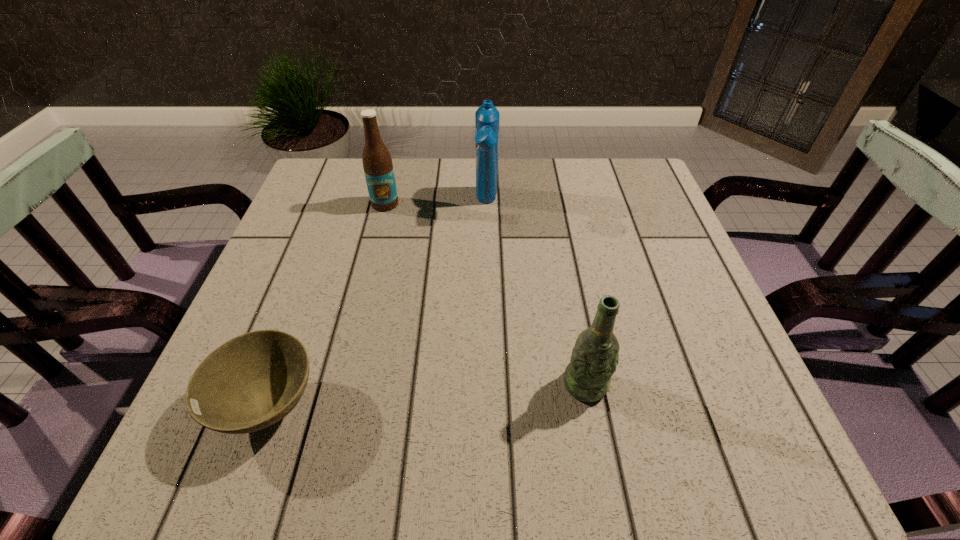
You are a GUI agent. You are given a task and a screenshot of the screen. Output one action in this format:
    pyautogui.click(x=<x>, y=<y>)
    Task: Click on the beer bottle located at the far edge
    
    Given the screenshot: What is the action you would take?
    pyautogui.click(x=378, y=168)

Find the location of `object positioned at the near edge`. object positioned at the near edge is located at coordinates (254, 380).

Identify the location of object present at the left edge. The width and height of the screenshot is (960, 540). (254, 380).

Where is `object positioned at the near left corner`? Image resolution: width=960 pixels, height=540 pixels. object positioned at the near left corner is located at coordinates (254, 380).

Identify the location of free point at the far edge. The image size is (960, 540). (543, 171).

Where is `vacant region at the near edge of the desktop`? Image resolution: width=960 pixels, height=540 pixels. vacant region at the near edge of the desktop is located at coordinates (490, 457).

At what (x,y) coordinates should I click in order to perform the action: click on blank area at the left edge. Please return your answer as a coordinate pair (x, y). This screenshot has height=540, width=960. Looking at the image, I should click on (317, 269).

In the image, there is a desktop. At what (x,y) coordinates should I click in order to perform the action: click on vacant space at the right edge. Please return your answer as a coordinate pair (x, y). Looking at the image, I should click on point(654,249).

The image size is (960, 540). Find the location of `vacant space at the far left corner of the desktop`. vacant space at the far left corner of the desktop is located at coordinates (316, 166).

In the image, there is a desktop. Identify the location of vacant space at the near left corner. The width and height of the screenshot is (960, 540). (261, 436).